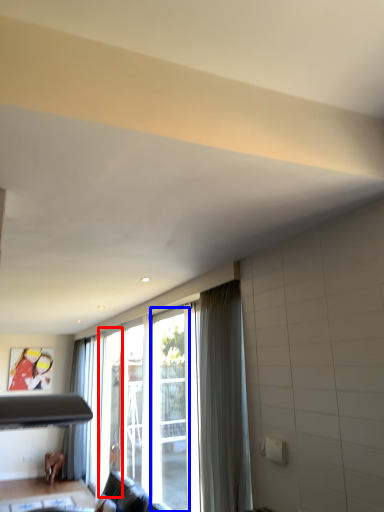
Question: Among these objects, which one is farthest to the camera, screen door (highlighted by a red box) or screen door (highlighted by a blue box)?

Choices:
 (A) screen door
 (B) screen door

Answer: (A)